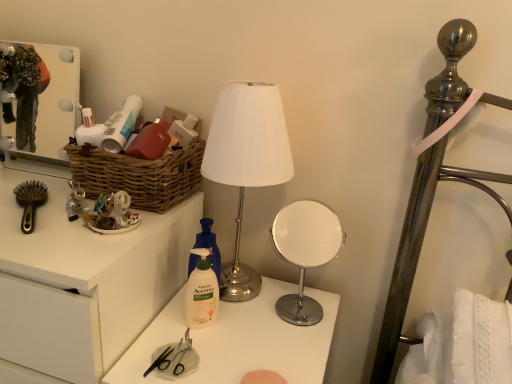
Locate an element on the screen. This screenshot has width=512, height=384. free space that is in between white glossy mirror at center right and white matte lotion at center, placed as the first toiletry when sorted from bottom to top is located at coordinates (252, 320).